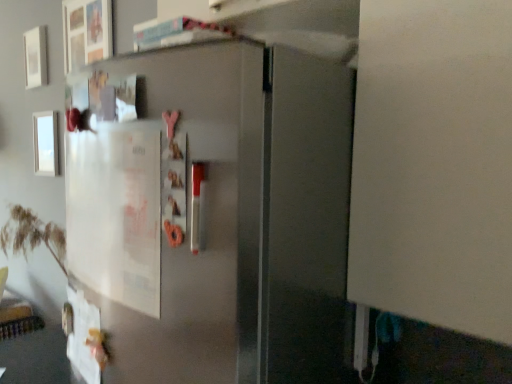
Question: Relative to white matte picture frame at upper left, which appears as the 1th picture frame when viewed from the top, is white glossy picture frame at upper left, the first picture frame from the bottom, in front or behind?

Choices:
 (A) behind
 (B) front

Answer: (B)

Question: Is white glossy picture frame at upper left, which appears as the second picture frame when viewed from the top, bigger or smaller than white matte picture frame at upper left, positioned as the second picture frame in bottom-to-top order?

Choices:
 (A) small
 (B) big

Answer: (A)

Question: Considering the positions of white glossy picture frame at upper left, which appears as the second picture frame when viewed from the top, and white matte picture frame at upper left, which appears as the 1th picture frame when viewed from the top, in the image, is white glossy picture frame at upper left, which appears as the second picture frame when viewed from the top, taller or shorter than white matte picture frame at upper left, which appears as the 1th picture frame when viewed from the top,?

Choices:
 (A) short
 (B) tall

Answer: (B)

Question: Is white matte picture frame at upper left, positioned as the second picture frame in bottom-to-top order, situated inside white glossy picture frame at upper left, the first picture frame from the bottom, or outside?

Choices:
 (A) outside
 (B) inside

Answer: (A)

Question: From the image's perspective, is white matte picture frame at upper left, positioned as the second picture frame in bottom-to-top order, above or below white glossy picture frame at upper left, the first picture frame from the bottom?

Choices:
 (A) above
 (B) below

Answer: (A)

Question: From a real-world perspective, relative to white glossy picture frame at upper left, which appears as the second picture frame when viewed from the top, is white matte picture frame at upper left, positioned as the second picture frame in bottom-to-top order, vertically above or below?

Choices:
 (A) below
 (B) above

Answer: (B)

Question: In terms of width, does white matte picture frame at upper left, positioned as the second picture frame in bottom-to-top order, look wider or thinner when compared to white glossy picture frame at upper left, which appears as the second picture frame when viewed from the top?

Choices:
 (A) thin
 (B) wide

Answer: (B)